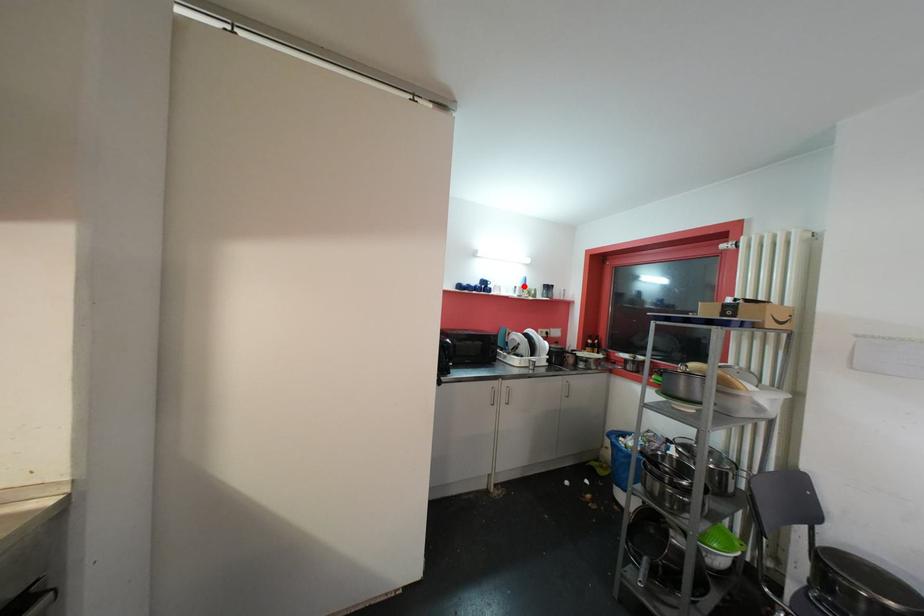
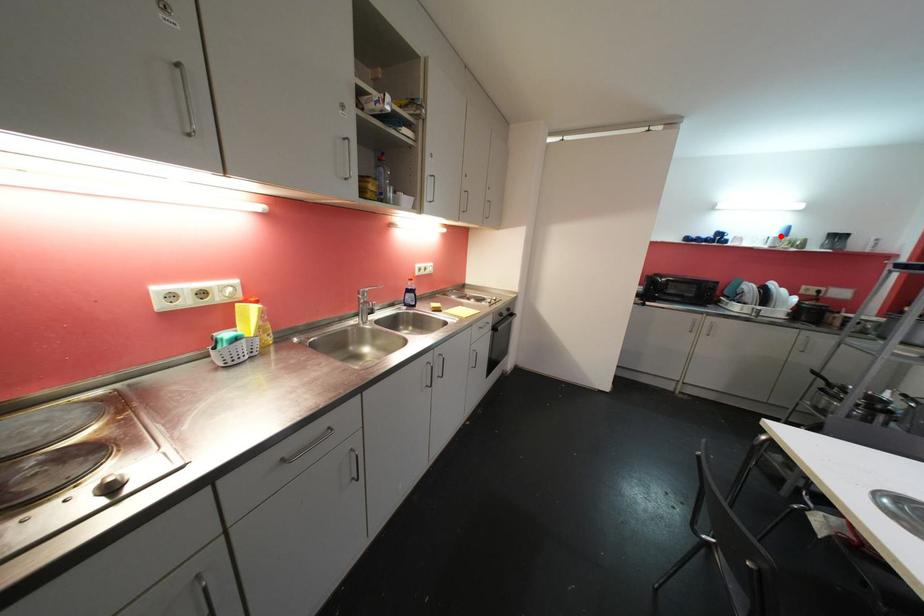
I am providing you with two images of the same scene from different viewpoints. A red point is marked on the first image and another point is marked on the second image. Does the point marked in image1 correspond to the same location as the one in image2?

Yes